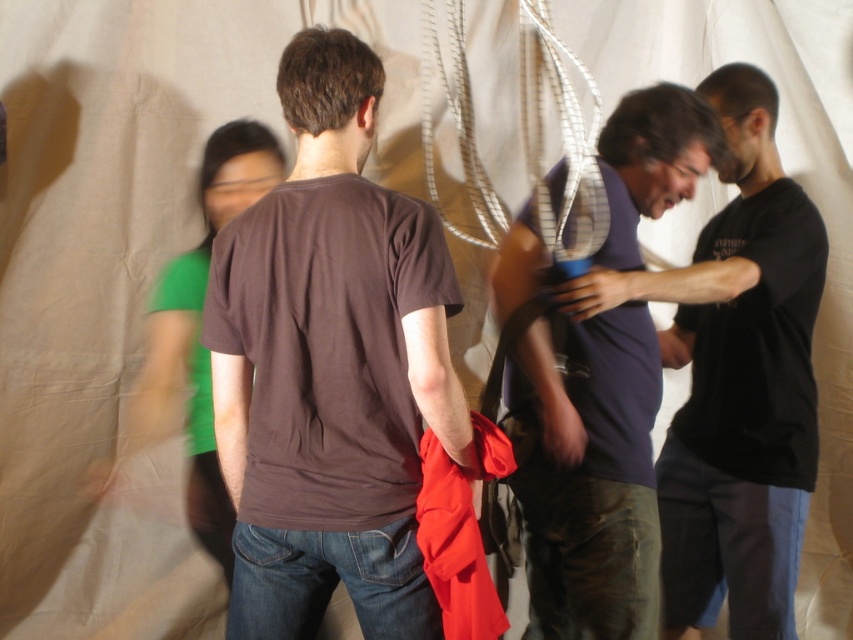
You are standing in the studio and want to place a small decoration between the two points, point (344, 380) and point (701, 141). Which point should the decoration be closer to in order to be nearer to the viewer?

The decoration should be closer to point (344, 380) because it is nearer to the viewer compared to point (701, 141).